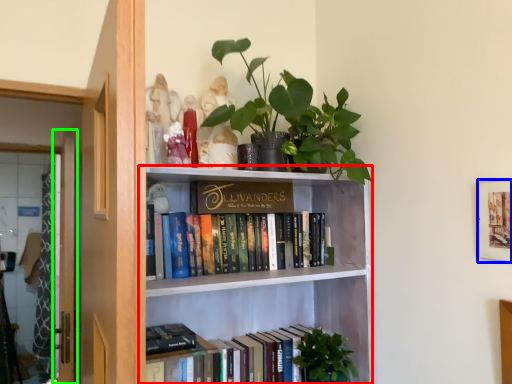
Question: Estimate the real-world distances between objects in this image. Which object is closer to bookcase (highlighted by a red box), picture frame (highlighted by a blue box) or screen door (highlighted by a green box)?

Choices:
 (A) picture frame
 (B) screen door

Answer: (A)